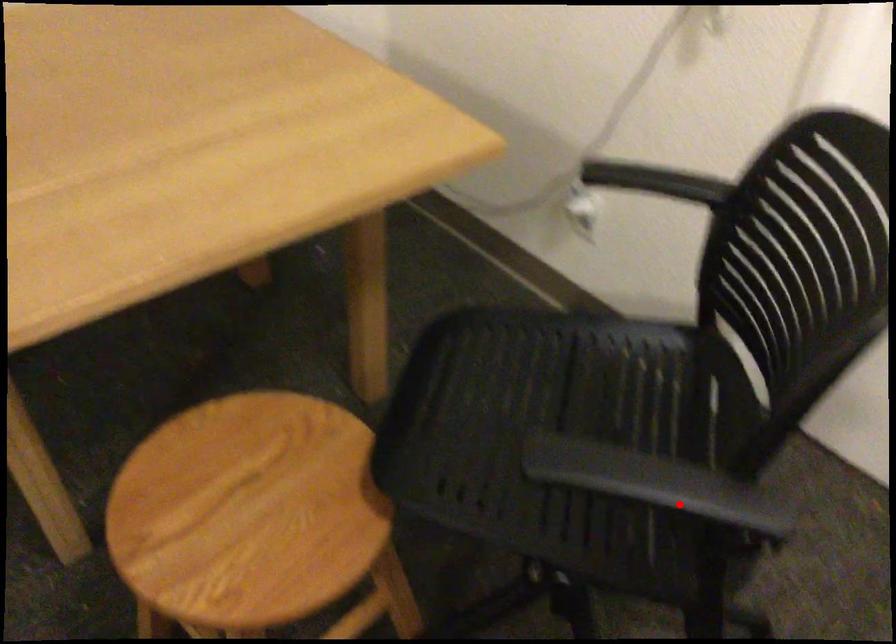
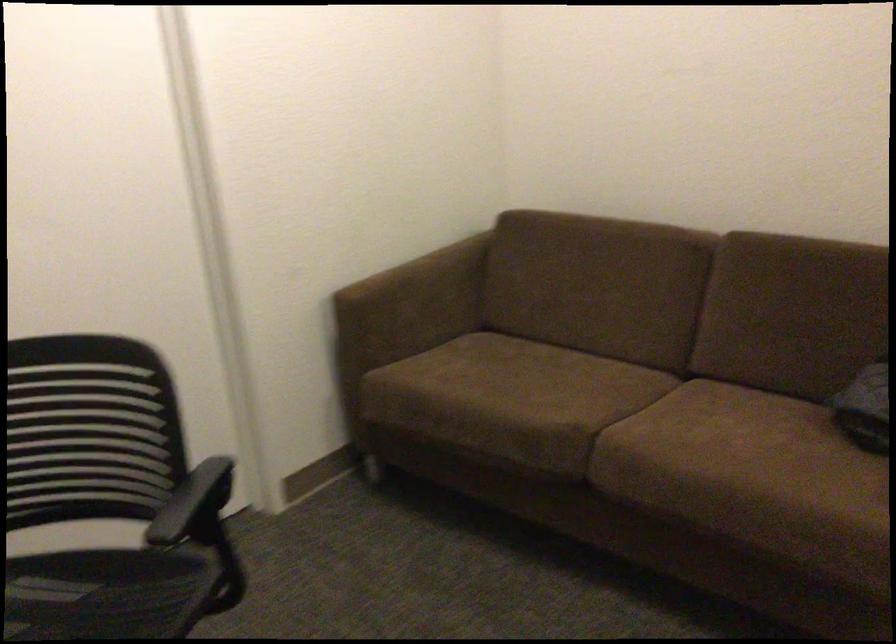
The point at the highlighted location is marked in the first image. Where is the corresponding point in the second image?

(192, 500)